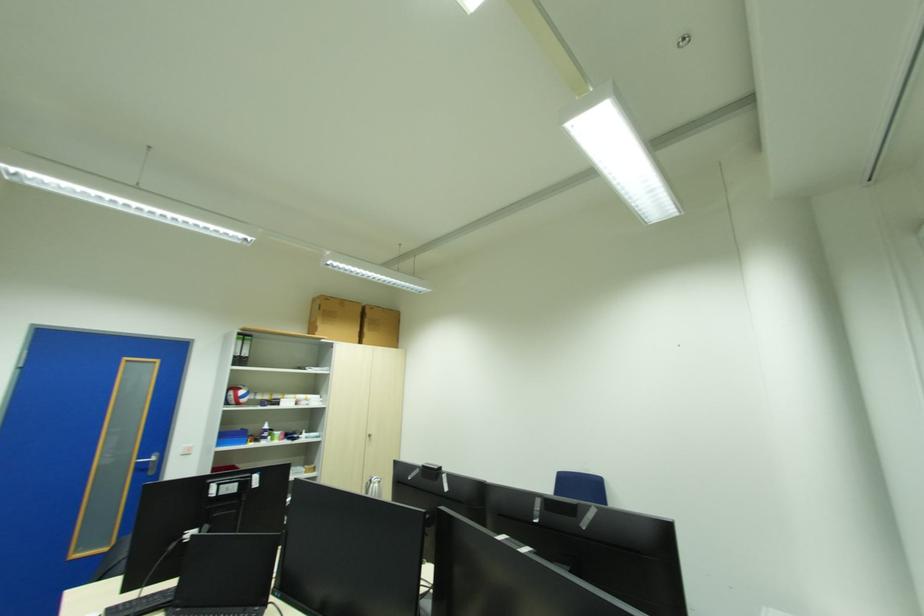
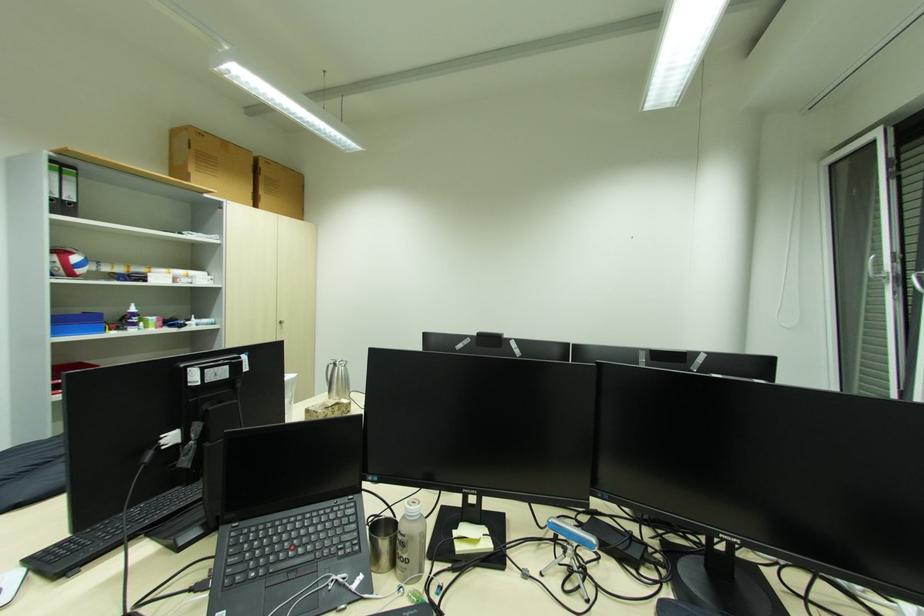
The images are taken continuously from a first-person perspective. In which direction are you moving?

The movement direction of the cameraman is left, forward.